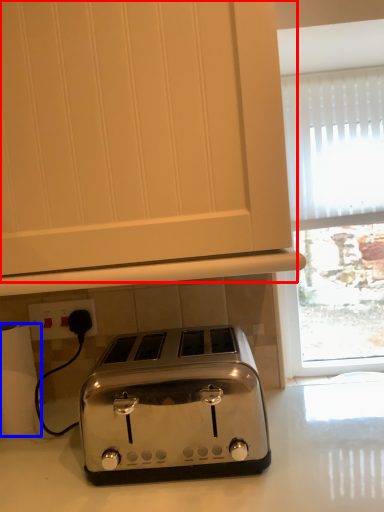
Question: Which object is closer to the camera taking this photo, oven (highlighted by a red box) or toilet paper (highlighted by a blue box)?

Choices:
 (A) oven
 (B) toilet paper

Answer: (A)